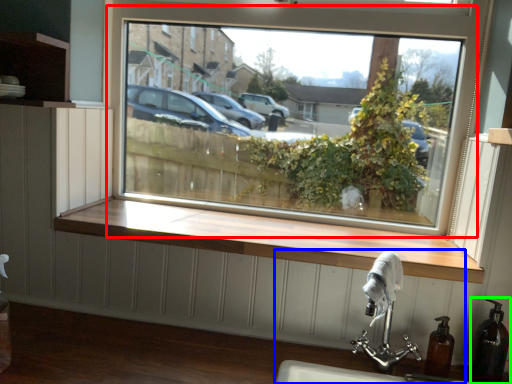
Question: Which object is positioned farthest from window (highlighted by a red box)? Select from sink (highlighted by a blue box) and soap dispenser (highlighted by a green box).

Choices:
 (A) sink
 (B) soap dispenser

Answer: (B)